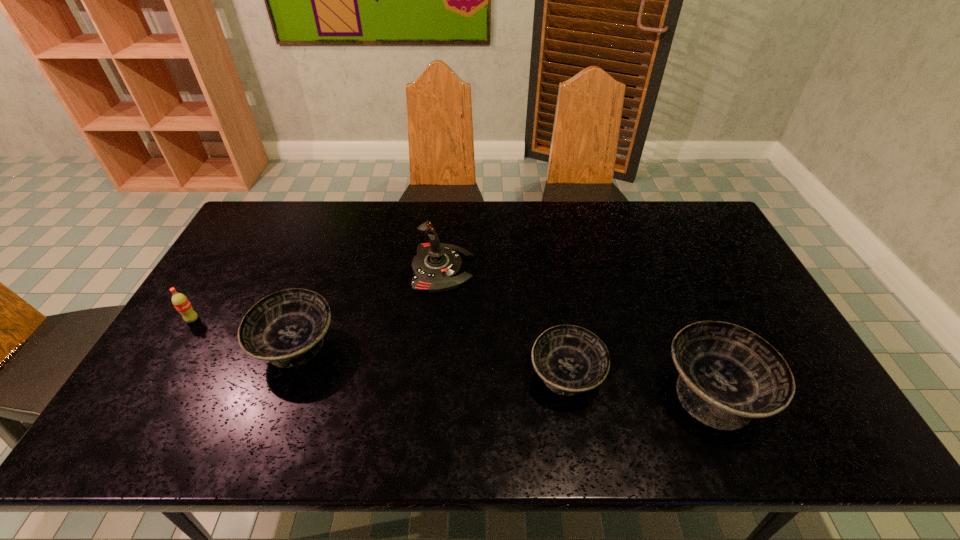
In the image, there is a desktop. Where is `vacant area at the near edge`? Image resolution: width=960 pixels, height=540 pixels. vacant area at the near edge is located at coordinates (297, 400).

The image size is (960, 540). In the image, there is a desktop. What are the coordinates of `free space at the left edge` in the screenshot? It's located at (229, 332).

You are a GUI agent. You are given a task and a screenshot of the screen. Output one action in this format:
    pyautogui.click(x=<x>, y=<y>)
    Task: Click on the vacant space at the right edge of the desktop
    
    Given the screenshot: What is the action you would take?
    pyautogui.click(x=768, y=340)

The height and width of the screenshot is (540, 960). I want to click on vacant space at the far left corner of the desktop, so click(x=276, y=210).

Locate an element on the screen. free space between the rightmost bowl and the third object from right to left is located at coordinates (639, 384).

Locate an element on the screen. The width and height of the screenshot is (960, 540). vacant space in between the leftmost bowl and the rightmost bowl is located at coordinates (505, 369).

Image resolution: width=960 pixels, height=540 pixels. Identify the location of unoccupied area between the leftmost bowl and the shortest object. (501, 317).

Locate an element on the screen. Image resolution: width=960 pixels, height=540 pixels. free point between the leftmost bowl and the rightmost bowl is located at coordinates (505, 369).

Where is `vacant area that lies between the fifth tallest object and the soda`? The height and width of the screenshot is (540, 960). vacant area that lies between the fifth tallest object and the soda is located at coordinates (379, 348).

This screenshot has width=960, height=540. Find the location of `free space between the shortest object and the soda`. free space between the shortest object and the soda is located at coordinates (449, 303).